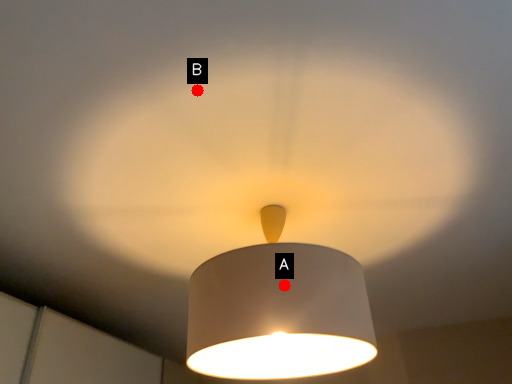
Question: Two points are circled on the image, labeled by A and B beside each circle. Which point is farther to the camera?

Choices:
 (A) A is further
 (B) B is further

Answer: (A)